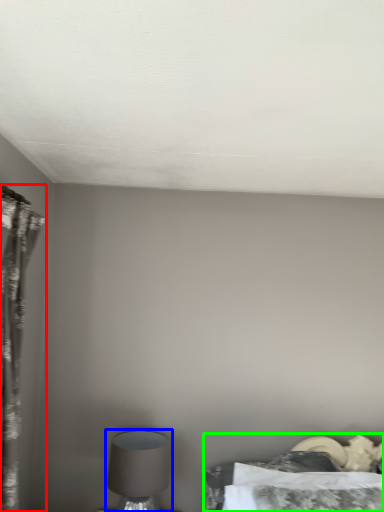
Question: Which is nearer to the curtain (highlighted by a red box)? table lamp (highlighted by a blue box) or bed (highlighted by a green box).

Choices:
 (A) table lamp
 (B) bed

Answer: (A)